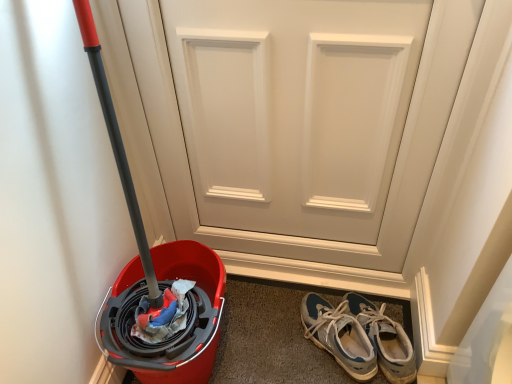
Where is `vacant space positioned to the left of blue suede sneakers at lower right, the 1th footwear in the right-to-left sequence`? The height and width of the screenshot is (384, 512). vacant space positioned to the left of blue suede sneakers at lower right, the 1th footwear in the right-to-left sequence is located at coordinates (289, 340).